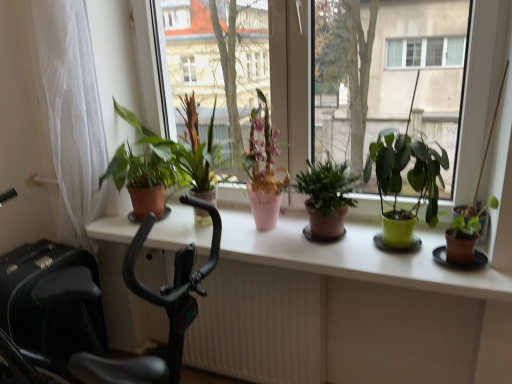
Question: Considering the positions of white sheer curtain at left and pink ceramic vase at center, which ranks as the 2th houseplant in left-to-right order, in the image, is white sheer curtain at left taller or shorter than pink ceramic vase at center, which ranks as the 2th houseplant in left-to-right order,?

Choices:
 (A) tall
 (B) short

Answer: (A)

Question: In terms of width, does white sheer curtain at left look wider or thinner when compared to pink ceramic vase at center, which is the 4th houseplant from right to left?

Choices:
 (A) thin
 (B) wide

Answer: (A)

Question: Which is farther from the green matte plant at left, the 1th houseplant when ordered from left to right?

Choices:
 (A) green matte plant at center, the 3th houseplant from the right
 (B) green matte plant pot at center
 (C) matte white windowsill at center
 (D) pink ceramic vase at center, which is the 4th houseplant from right to left
 (E) white sheer curtain at left

Answer: (A)

Question: Estimate the real-world distances between objects in this image. Which object is closer to the white sheer curtain at left?

Choices:
 (A) green matte plant at center, the 3th houseplant from the right
 (B) brown matte pot at right, arranged as the fifth houseplant when viewed from the left
 (C) black plastic exercise bike at left
 (D) green matte plant at center, which is the 4th houseplant in left-to-right order
 (E) pink ceramic vase at center, which is the 4th houseplant from right to left

Answer: (C)